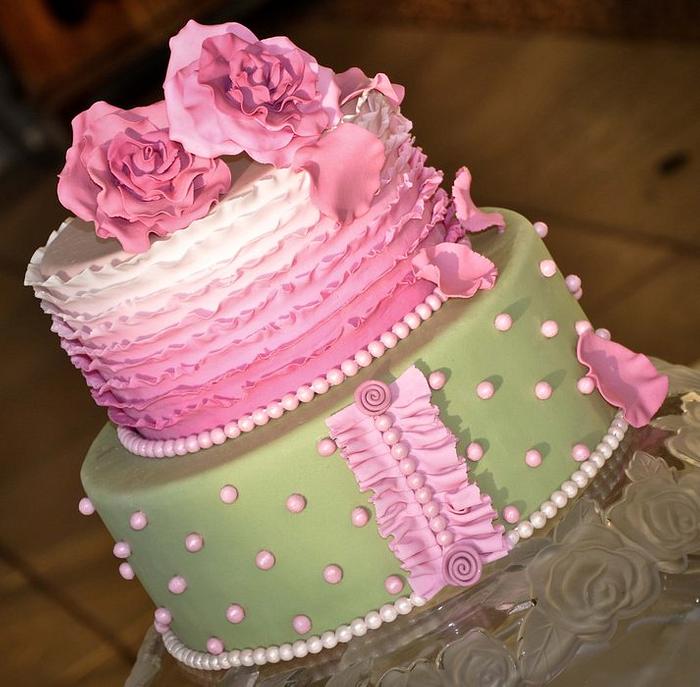
Where is `pink pearl decor`? The height and width of the screenshot is (687, 700). pink pearl decor is located at coordinates pyautogui.click(x=439, y=374).